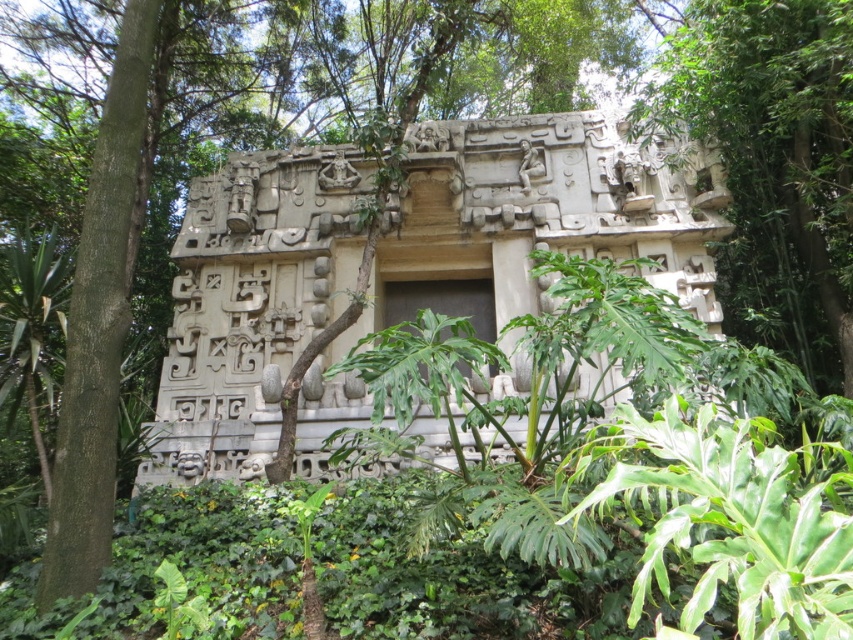
Question: Does white stone carving at center have a greater width compared to green leafy plant at center?

Choices:
 (A) no
 (B) yes

Answer: (B)

Question: Is white stone carving at center bigger than green leafy plant at center?

Choices:
 (A) no
 (B) yes

Answer: (A)

Question: Which point is farther from the camera taking this photo?

Choices:
 (A) (209, 429)
 (B) (814, 381)

Answer: (A)

Question: Is white stone carving at center thinner than green leafy plant at center?

Choices:
 (A) yes
 (B) no

Answer: (B)

Question: Which object is farther from the camera taking this photo?

Choices:
 (A) green leafy plant at center
 (B) white stone carving at center

Answer: (B)

Question: Which point is closer to the camera?

Choices:
 (A) (775, 24)
 (B) (676, 253)

Answer: (A)